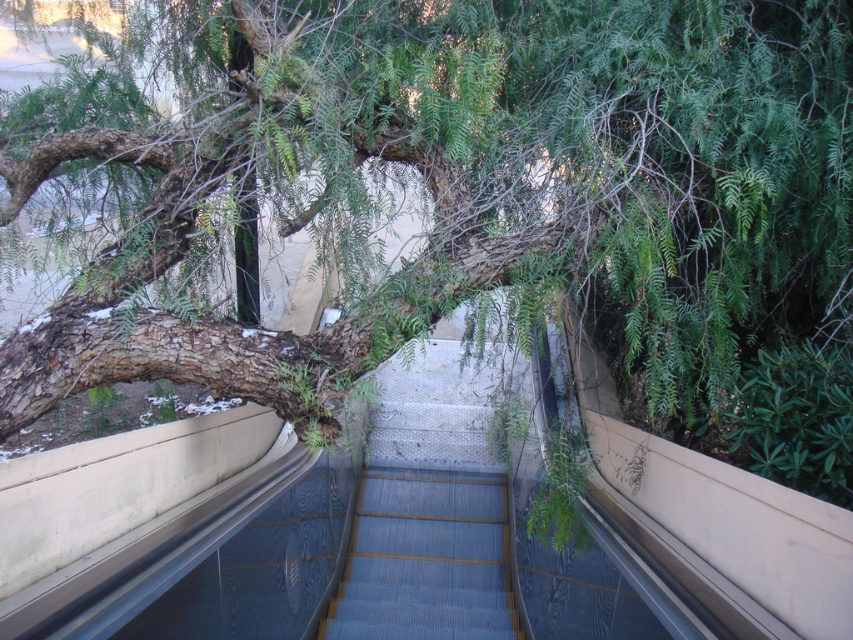
Question: Can you confirm if green leafy tree at upper left is bigger than smooth blue stairs at center?

Choices:
 (A) yes
 (B) no

Answer: (A)

Question: Is green leafy tree at upper left wider than smooth blue stairs at center?

Choices:
 (A) no
 (B) yes

Answer: (B)

Question: Which of the following is the closest to the observer?

Choices:
 (A) (718, 221)
 (B) (419, 500)

Answer: (A)

Question: Does green leafy tree at upper left come in front of smooth blue stairs at center?

Choices:
 (A) yes
 (B) no

Answer: (A)